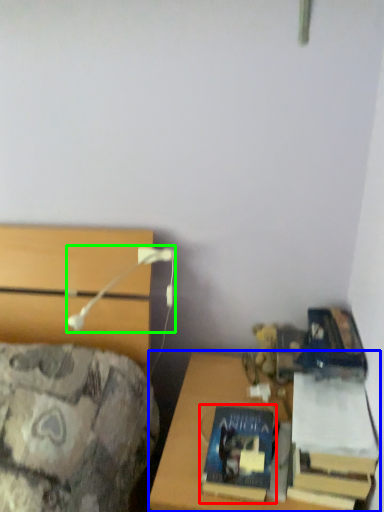
Question: Based on their relative distances, which object is farther from book (highlighted by a red box)? Choose from desk (highlighted by a blue box) and table lamp (highlighted by a green box).

Choices:
 (A) desk
 (B) table lamp

Answer: (B)